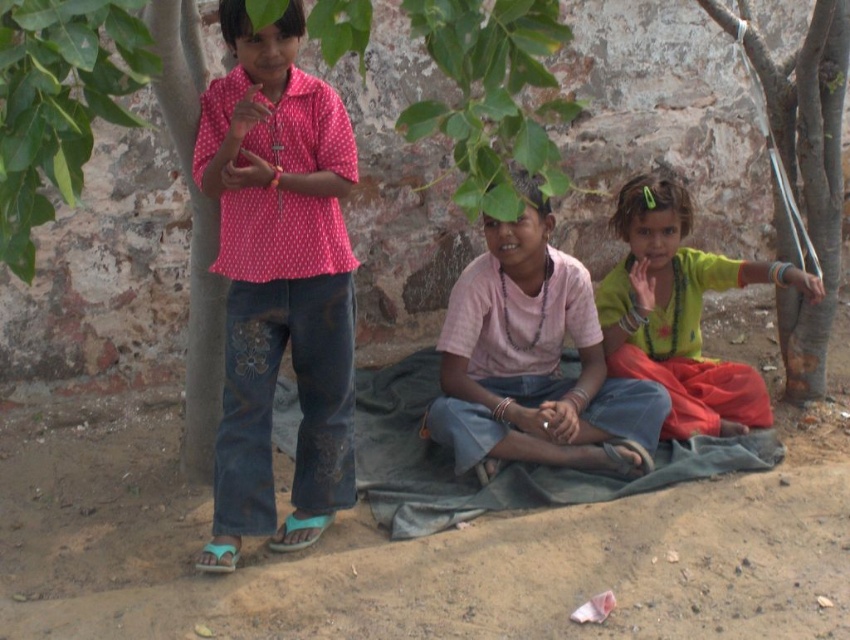
In the scene shown: Is pink dotted shirt at center to the left of pink cotton shirt at center from the viewer's perspective?

Indeed, pink dotted shirt at center is positioned on the left side of pink cotton shirt at center.

Who is taller, pink dotted shirt at center or pink cotton shirt at center?

With more height is pink dotted shirt at center.

Is point (268, 372) farther from viewer compared to point (468, 448)?

No, (268, 372) is in front of (468, 448).

Locate an element on the screen. The width and height of the screenshot is (850, 640). pink dotted shirt at center is located at coordinates (278, 282).

Is point (539, 362) positioned in front of point (621, 220)?

Yes.

Can you confirm if pink cotton shirt at center is smaller than green fabric at right?

No.

Is point (471, 422) positioned before point (656, 205)?

Yes, it is in front of point (656, 205).

Locate an element on the screen. The height and width of the screenshot is (640, 850). pink cotton shirt at center is located at coordinates (534, 362).

In the scene shown: Does pink cotton shirt at center appear on the right side of green leafy tree at upper left?

Indeed, pink cotton shirt at center is positioned on the right side of green leafy tree at upper left.

Measure the distance between point (544, 378) and camera.

Point (544, 378) and camera are 13.07 feet apart.

You are a GUI agent. You are given a task and a screenshot of the screen. Output one action in this format:
    pyautogui.click(x=<x>, y=<y>)
    Task: Click on the pink cotton shirt at center
    This screenshot has width=850, height=640.
    Given the screenshot: What is the action you would take?
    pyautogui.click(x=534, y=362)